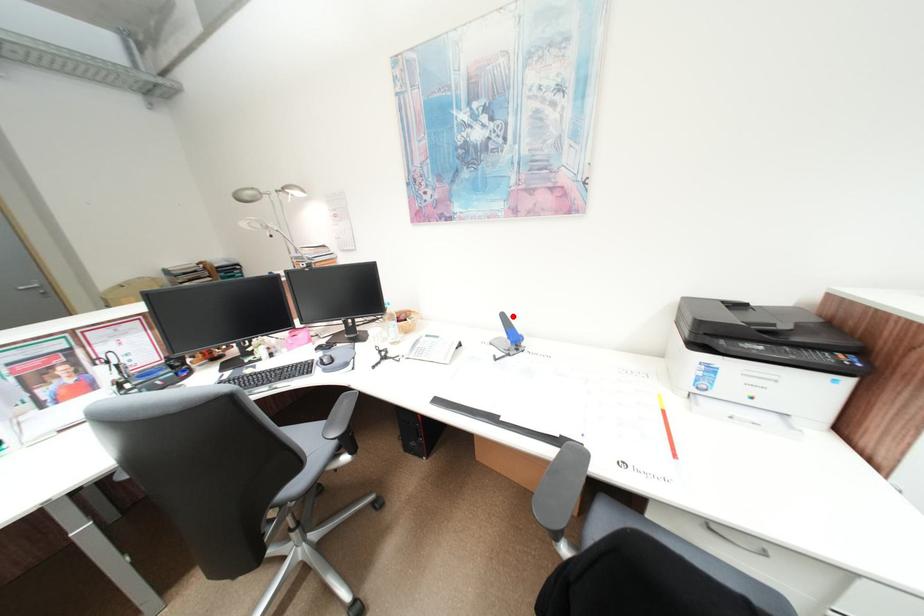
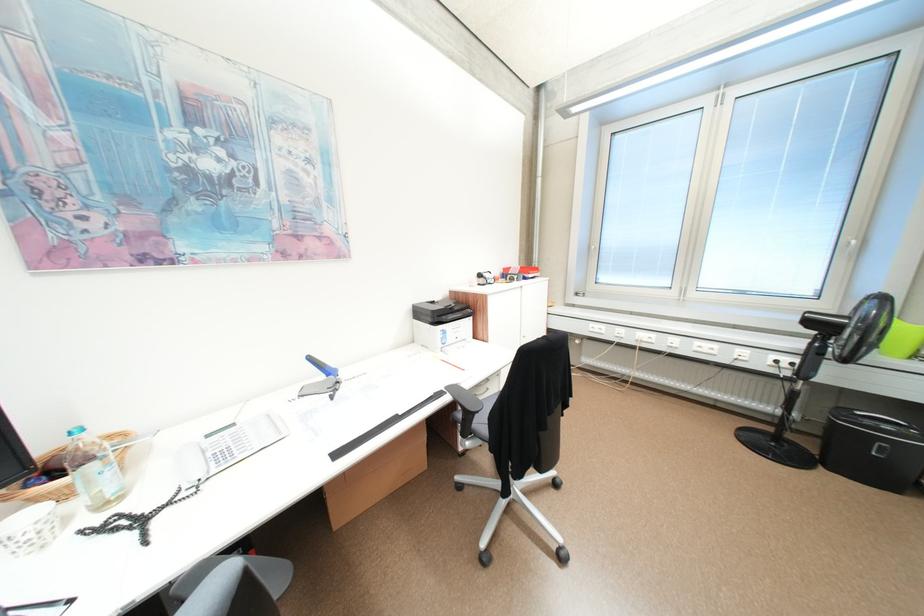
Question: I am providing you with two images of the same scene from different viewpoints. In image1, a red point is highlighted. Considering the same 3D point in image2, which of the following is correct?

Choices:
 (A) It is closer
 (B) It is farther

Answer: (A)